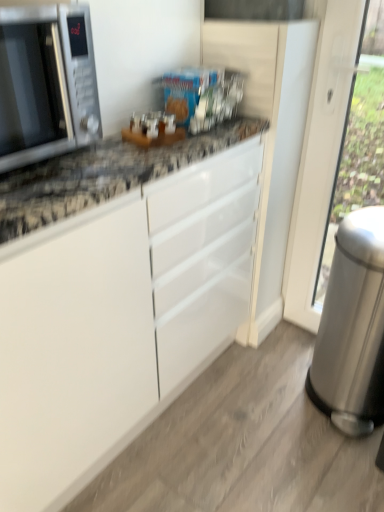
Question: Is satin silver microwave at left at the left side of silver metallic trash can at right?

Choices:
 (A) yes
 (B) no

Answer: (A)

Question: From a real-world perspective, is satin silver microwave at left physically above silver metallic trash can at right?

Choices:
 (A) no
 (B) yes

Answer: (B)

Question: Can you confirm if satin silver microwave at left is positioned to the right of silver metallic trash can at right?

Choices:
 (A) yes
 (B) no

Answer: (B)

Question: Is satin silver microwave at left oriented away from silver metallic trash can at right?

Choices:
 (A) no
 (B) yes

Answer: (A)

Question: Is satin silver microwave at left not near silver metallic trash can at right?

Choices:
 (A) yes
 (B) no

Answer: (B)

Question: From the image's perspective, is satin silver microwave at left under silver metallic trash can at right?

Choices:
 (A) no
 (B) yes

Answer: (A)

Question: Is silver metallic trash can at right in contact with satin silver microwave at left?

Choices:
 (A) yes
 (B) no

Answer: (B)

Question: Can we say silver metallic trash can at right lies outside satin silver microwave at left?

Choices:
 (A) yes
 (B) no

Answer: (A)

Question: Can you confirm if silver metallic trash can at right is smaller than satin silver microwave at left?

Choices:
 (A) yes
 (B) no

Answer: (B)

Question: Is silver metallic trash can at right aimed at satin silver microwave at left?

Choices:
 (A) yes
 (B) no

Answer: (B)

Question: Is silver metallic trash can at right taller than satin silver microwave at left?

Choices:
 (A) yes
 (B) no

Answer: (A)

Question: From a real-world perspective, is silver metallic trash can at right below satin silver microwave at left?

Choices:
 (A) no
 (B) yes

Answer: (B)

Question: Which is correct: silver metallic trash can at right is inside satin silver microwave at left, or outside of it?

Choices:
 (A) inside
 (B) outside

Answer: (B)